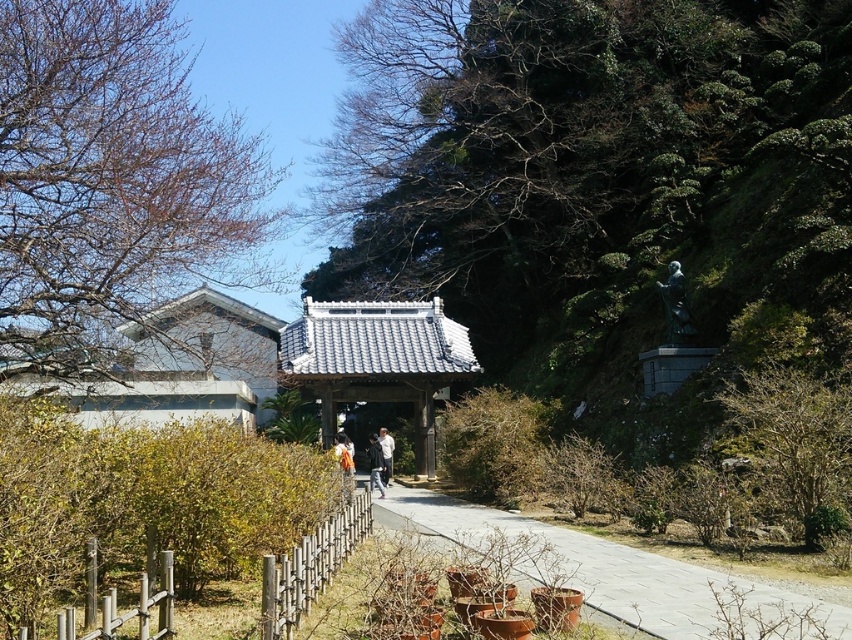
You are a visitor standing at the entrance of the traditional Japanese gate. You want to walk to the statue on the right side of the path. Which object, the smooth concrete path at center or the wooden fence at lower center, will you step over first?

The smooth concrete path at center is much taller than the wooden fence at lower center, so you will step over the wooden fence at lower center first before reaching the smooth concrete path at center.

You are visiting a traditional Japanese garden and notice the bare branches at upper left and the dark gray jacket at center. Which object takes up more space in the image?

The bare branches at upper left takes up more space in the image than the dark gray jacket at center because it is bigger.

From the picture: You are a visitor at this Japanese garden and see both the dark gray jacket at center and the orange fabric at center. Which item is located to the right when facing the scene?

The dark gray jacket at center is positioned on the right side of orange fabric at center, so when facing the scene, the dark gray jacket at center is to the right of the orange fabric at center.